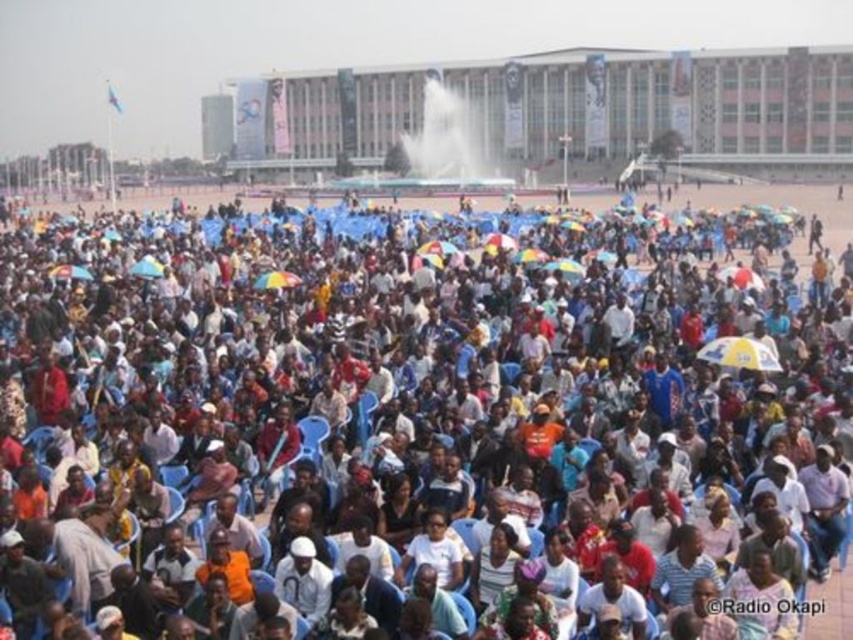
Is white plastic chairs at center below yellowmaterial/textureumbrella at center?

No, white plastic chairs at center is not below yellowmaterial/textureumbrella at center.

The image size is (853, 640). What do you see at coordinates (407, 404) in the screenshot?
I see `white plastic chairs at center` at bounding box center [407, 404].

I want to click on white plastic chairs at center, so click(407, 404).